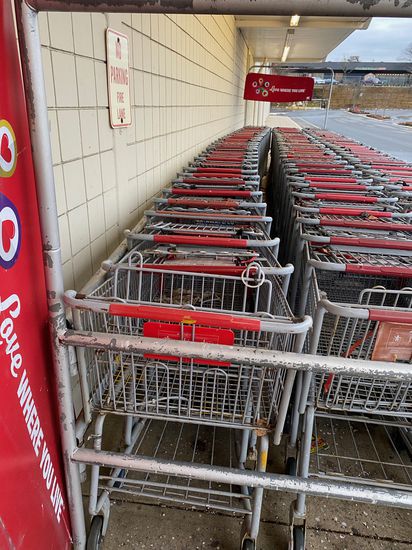
The width and height of the screenshot is (412, 550). Find the location of `red wall`. red wall is located at coordinates (35, 509).